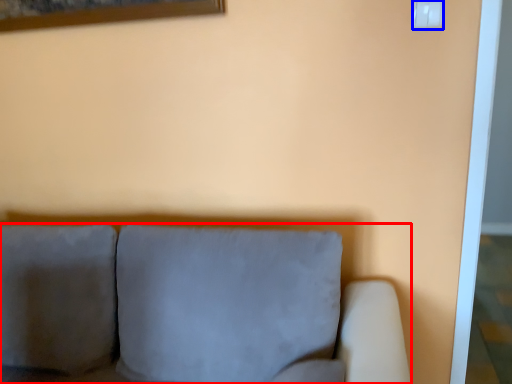
Question: Which object is further to the camera taking this photo, studio couch (highlighted by a red box) or electric outlet (highlighted by a blue box)?

Choices:
 (A) studio couch
 (B) electric outlet

Answer: (B)